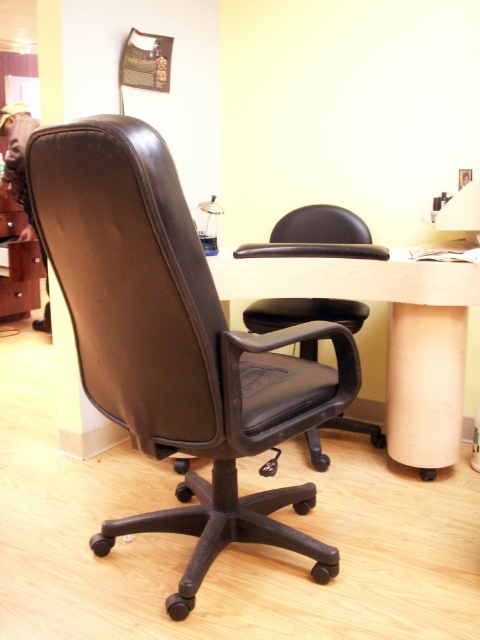
Can you confirm if black leather office chair at center is taller than matte brown drawer at left?

Correct, black leather office chair at center is much taller as matte brown drawer at left.

Who is more forward, (x=165, y=364) or (x=23, y=310)?

Point (x=165, y=364) is in front.

Which is in front, point (106, 545) or point (16, 310)?

Positioned in front is point (106, 545).

The width and height of the screenshot is (480, 640). I want to click on black leather office chair at center, so click(175, 342).

Is black leather office chair at center below light wood computer desk at center?

Incorrect, black leather office chair at center is not positioned below light wood computer desk at center.

Which of these two, black leather office chair at center or light wood computer desk at center, stands taller?

With more height is light wood computer desk at center.

Identify the location of black leather office chair at center. Image resolution: width=480 pixels, height=640 pixels. (175, 342).

Looking at this image, does light wood computer desk at center appear on the right side of matte brown drawer at left?

Indeed, light wood computer desk at center is positioned on the right side of matte brown drawer at left.

This screenshot has width=480, height=640. What do you see at coordinates (388, 333) in the screenshot?
I see `light wood computer desk at center` at bounding box center [388, 333].

Who is more distant from viewer, (x=397, y=458) or (x=36, y=272)?

The point (x=36, y=272) is behind.

Identify the location of light wood computer desk at center. (388, 333).